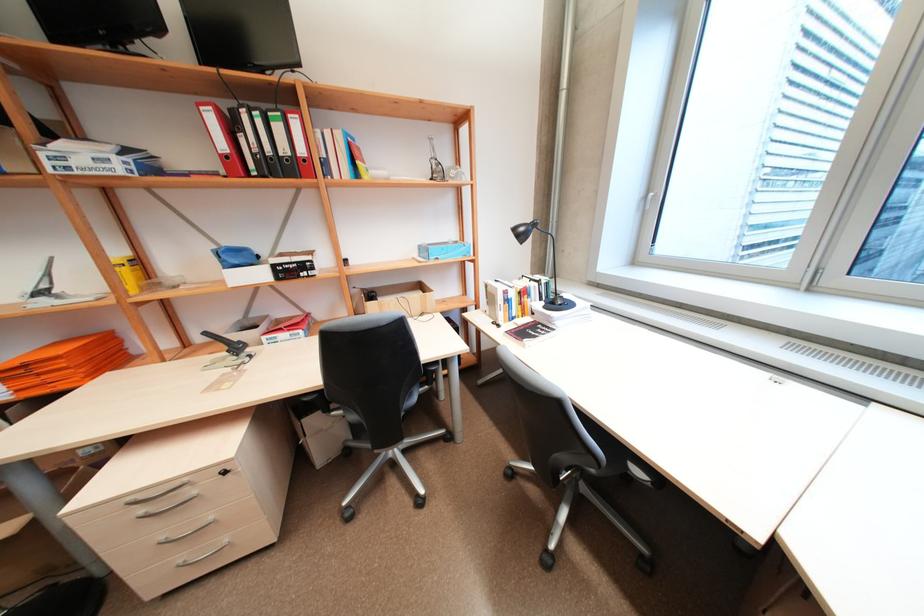
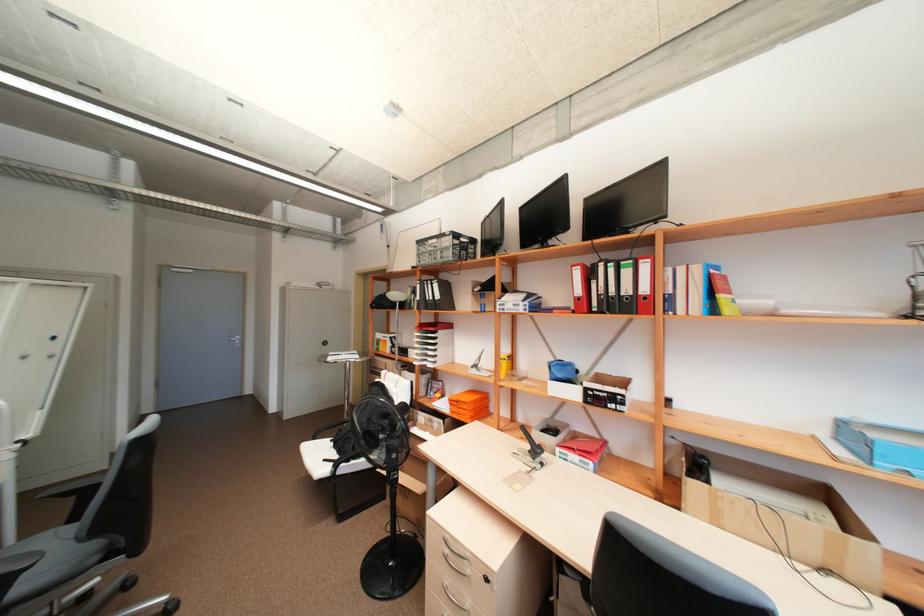
Where in the second image is the point corresponding to point 286,329 from the first image?

(578, 448)